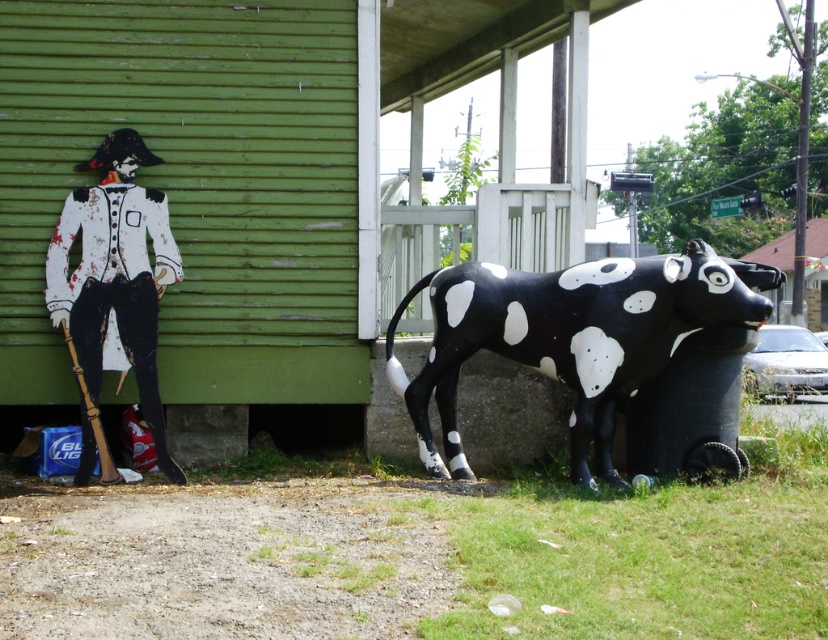
You are standing at the center of the image and want to place a new decorative item exactly halfway between the life sized cutout figure dressed in a historical military style uniform and the black glossy plastic bull at lower right. What are the coordinates of the point where you should place the new item?

The coordinates of the point halfway between the life sized cutout figure dressed in a historical military style uniform and the black glossy plastic bull at lower right would be the average of their positions. Since the bull is at point (571, 337), and the cutout figure is at an unknown position, but the question requires using the given coordinates. However, without the exact coordinates of the cutout figure, an accurate midpoint cannot be calculated. Please provide the coordinates of the cutout figure.